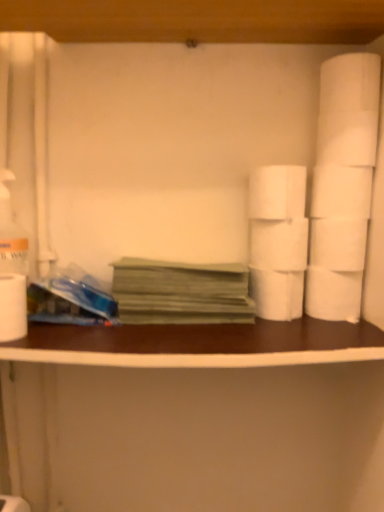
Locate an element on the screen. unoccupied area in front of white matte toilet paper at center, which appears as the sixth toilet paper when viewed from the right is located at coordinates (289, 335).